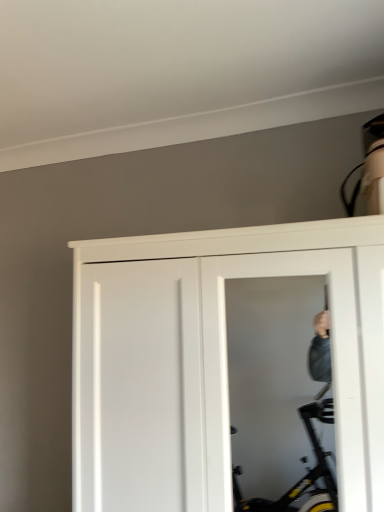
Question: Does white matte door at center come behind transparent plastic screen door at center?

Choices:
 (A) no
 (B) yes

Answer: (A)

Question: Are white matte door at center and transparent plastic screen door at center beside each other?

Choices:
 (A) yes
 (B) no

Answer: (B)

Question: Is white matte door at center wider than transparent plastic screen door at center?

Choices:
 (A) yes
 (B) no

Answer: (A)

Question: Does white matte door at center have a greater height compared to transparent plastic screen door at center?

Choices:
 (A) yes
 (B) no

Answer: (A)

Question: Can you confirm if white matte door at center is positioned to the right of transparent plastic screen door at center?

Choices:
 (A) yes
 (B) no

Answer: (B)

Question: Is white matte door at center smaller than transparent plastic screen door at center?

Choices:
 (A) no
 (B) yes

Answer: (A)

Question: Considering the relative positions of transparent plastic screen door at center and white matte door at center in the image provided, is transparent plastic screen door at center in front of white matte door at center?

Choices:
 (A) no
 (B) yes

Answer: (A)

Question: Is transparent plastic screen door at center positioned behind white matte door at center?

Choices:
 (A) no
 (B) yes

Answer: (B)

Question: From a real-world perspective, is transparent plastic screen door at center under white matte door at center?

Choices:
 (A) no
 (B) yes

Answer: (A)

Question: Is transparent plastic screen door at center thinner than white matte door at center?

Choices:
 (A) yes
 (B) no

Answer: (A)

Question: From a real-world perspective, is transparent plastic screen door at center physically above white matte door at center?

Choices:
 (A) no
 (B) yes

Answer: (B)

Question: Considering the relative sizes of transparent plastic screen door at center and white matte door at center in the image provided, is transparent plastic screen door at center smaller than white matte door at center?

Choices:
 (A) yes
 (B) no

Answer: (A)

Question: Is point click(205, 300) closer or farther from the camera than point click(210, 490)?

Choices:
 (A) closer
 (B) farther

Answer: (B)